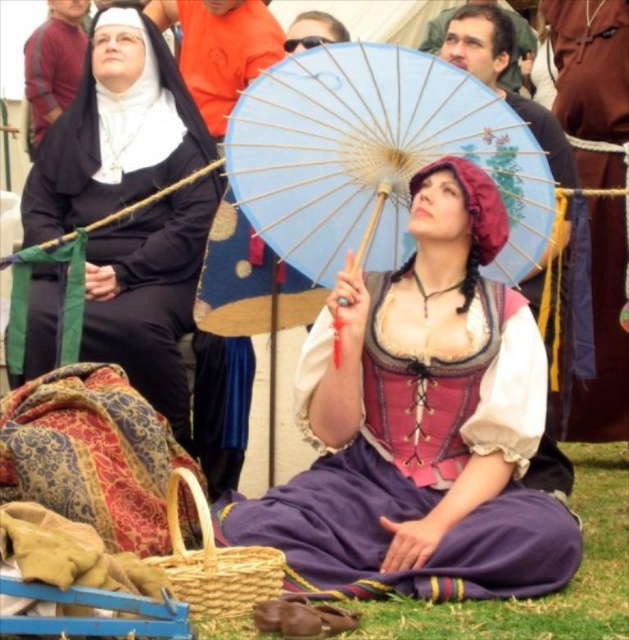
Which is more to the right, purple satin dress at center or brown leather belt at upper center?

brown leather belt at upper center is more to the right.

Who is more forward, (35, 275) or (599, 365)?

Point (35, 275) is in front.

What do you see at coordinates (114, 131) in the screenshot? I see `purple satin dress at center` at bounding box center [114, 131].

Identify the location of purple satin dress at center. The height and width of the screenshot is (640, 629). (114, 131).

Is matte pink fabric dress at center above purple satin dress at center?

Incorrect, matte pink fabric dress at center is not positioned above purple satin dress at center.

At what (x,y) coordinates should I click in order to perform the action: click on matte pink fabric dress at center. Please return your answer as a coordinate pair (x, y). This screenshot has width=629, height=640. Looking at the image, I should click on (421, 422).

Who is more distant from viewer, [460,406] or [181,108]?

The point [181,108] is more distant.

At what (x,y) coordinates should I click in order to perform the action: click on matte pink fabric dress at center. Please return your answer as a coordinate pair (x, y). This screenshot has height=640, width=629. Looking at the image, I should click on (421, 422).

Does matte pink fabric dress at center have a larger size compared to blue paper umbrella at center?

Yes, matte pink fabric dress at center is bigger than blue paper umbrella at center.

This screenshot has width=629, height=640. Describe the element at coordinates (421, 422) in the screenshot. I see `matte pink fabric dress at center` at that location.

Between point (367, 417) and point (265, 77), which one is positioned behind?

Point (265, 77)

This screenshot has height=640, width=629. In order to click on matte pink fabric dress at center in this screenshot , I will do `click(421, 422)`.